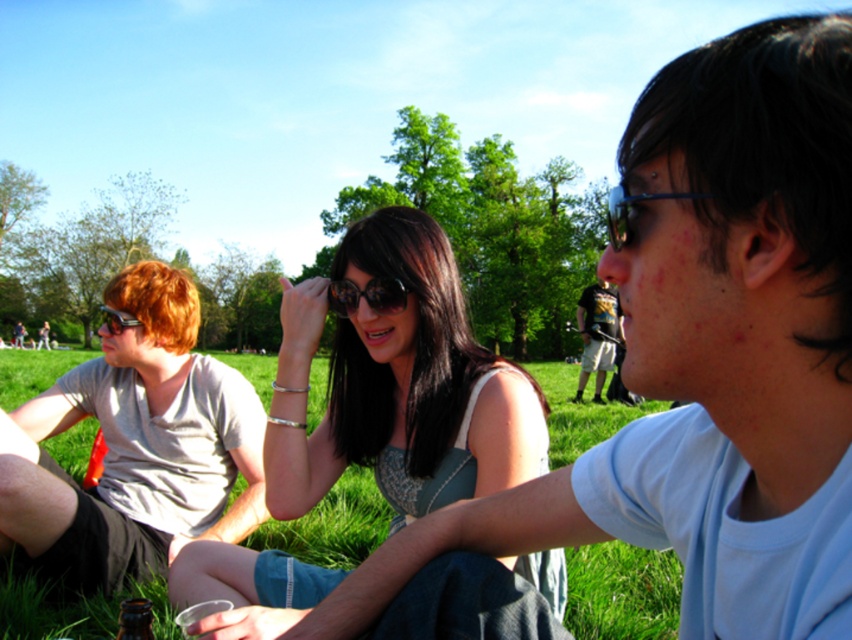
You are a photographer trying to capture a candid shot of the two items at the center of the scene. Since you want to ensure both the dark blue jeans at center and the black reflective sunglasses at center are clearly visible in the photo, which item should you focus on first to ensure depth of field? Explain your reasoning based on their positions.

The dark blue jeans at center has a greater height compared to the black reflective sunglasses at center. To ensure both are clearly visible, focus on the dark blue jeans at center first since it is taller and likely farther away, allowing the sunglasses to fall within the depth of field range.

You are standing in the park and want to place a small flag at each of these two points. Which point, point (181, 364) or point (632, 419), will have its flag appear taller from your viewpoint?

Point (181, 364) is closer to the camera than point (632, 419). Therefore, the flag placed at point (181, 364) will appear taller from your viewpoint.